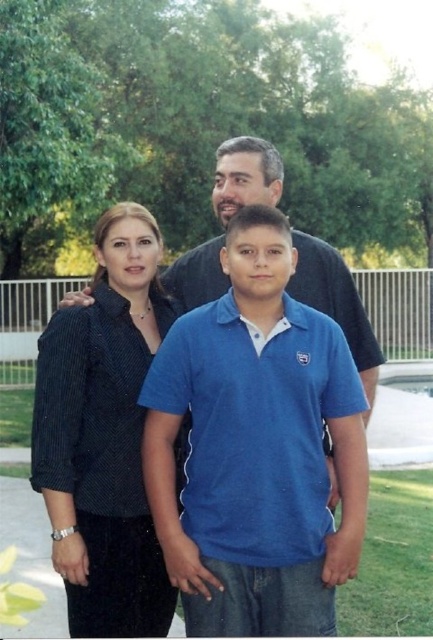
In the scene, there are two adults wearing shirts. The first is wearing a dark blue striped shirt at left, and the second is wearing a blue cotton shirt at center. From the perspective of someone facing the family, which shirt is positioned to the right?

The blue cotton shirt at center is positioned to the right of the dark blue striped shirt at left.

You are a photographer standing at the center of the park. You want to take a photo of the blue cotton shirt at center and the dark blue striped shirt at left. The minimum distance required for your camera to focus on both subjects clearly is 50 centimeters. Can you capture both shirts in focus without moving?

The blue cotton shirt at center is 51.61 centimeters away from the dark blue striped shirt at left. Since the minimum focus distance required is 50 centimeters and the actual distance is slightly over, the camera can still capture both shirts in focus as the distance meets the requirement.